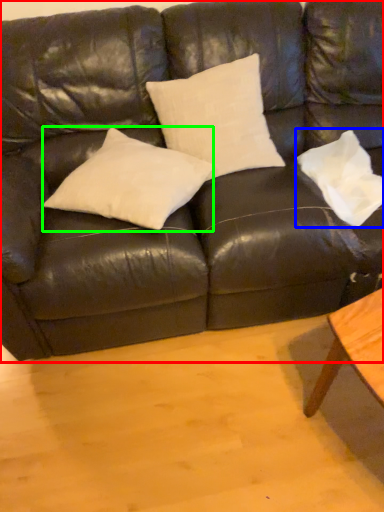
Question: Which object is positioned closest to studio couch (highlighted by a red box)? Select from pillow (highlighted by a blue box) and pillow (highlighted by a green box).

Choices:
 (A) pillow
 (B) pillow

Answer: (B)